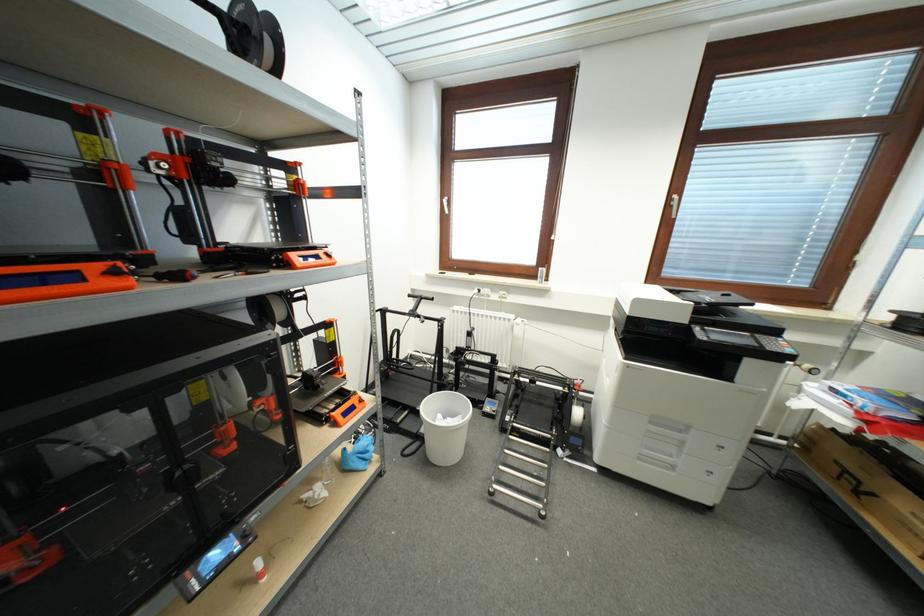
Which object does [528,444] point to?

This point indicates the metal step stool.